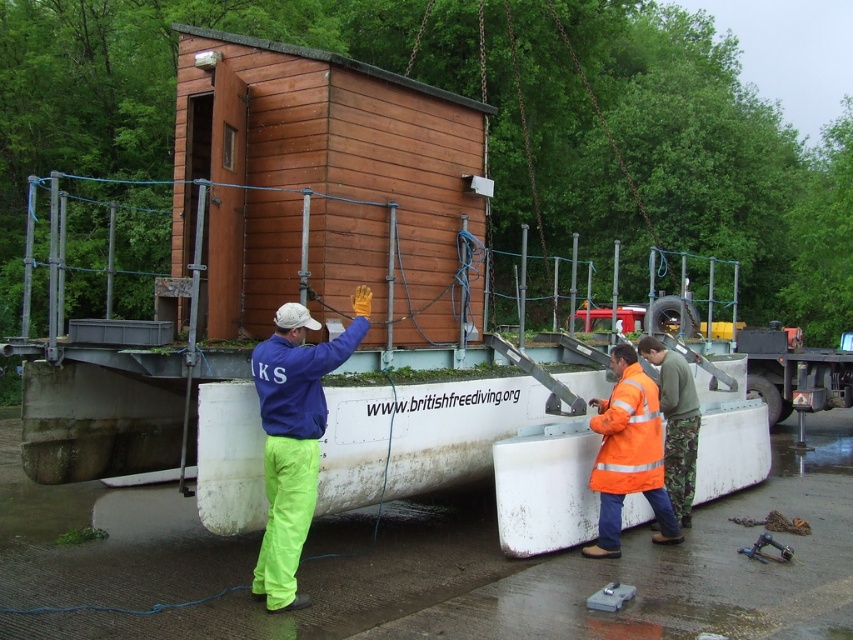
Question: Does neon green pants at center appear on the left side of orange reflective jacket at lower right?

Choices:
 (A) no
 (B) yes

Answer: (B)

Question: Is neon green pants at center thinner than orange reflective jacket at lower right?

Choices:
 (A) yes
 (B) no

Answer: (A)

Question: Which object is closer to the camera taking this photo?

Choices:
 (A) neon green pants at center
 (B) metallic trailer truck at right

Answer: (A)

Question: Considering the relative positions of neon green pants at center and orange reflective jacket at lower right in the image provided, where is neon green pants at center located with respect to orange reflective jacket at lower right?

Choices:
 (A) below
 (B) above

Answer: (B)

Question: Which of the following is the closest to the observer?

Choices:
 (A) (299, 529)
 (B) (793, 364)
 (C) (598, 554)

Answer: (A)

Question: Which is nearer to the neon green pants at center?

Choices:
 (A) orange reflective jacket at lower right
 (B) metallic trailer truck at right

Answer: (A)